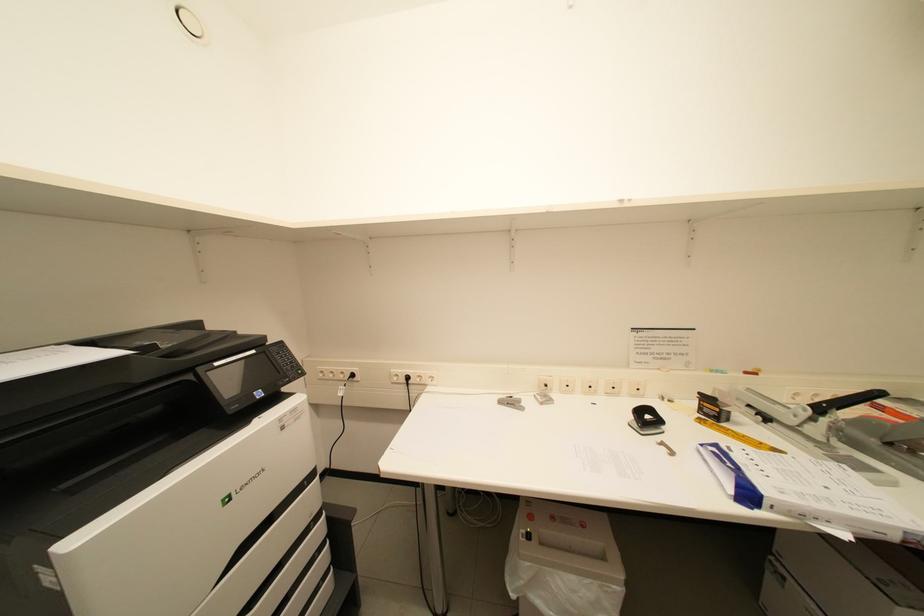
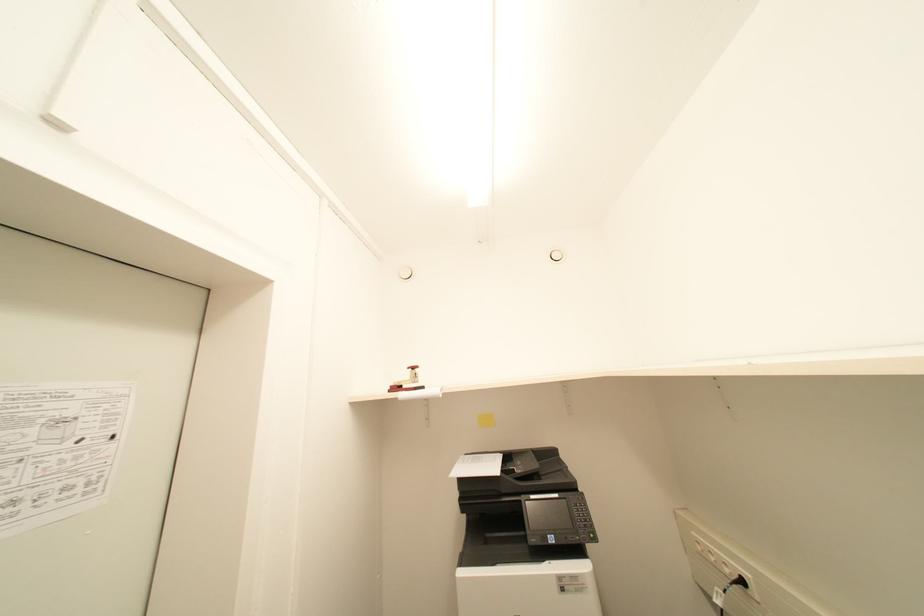
First-person continuous shooting, in which direction is the camera rotating?

The camera's rotation is toward left-up.